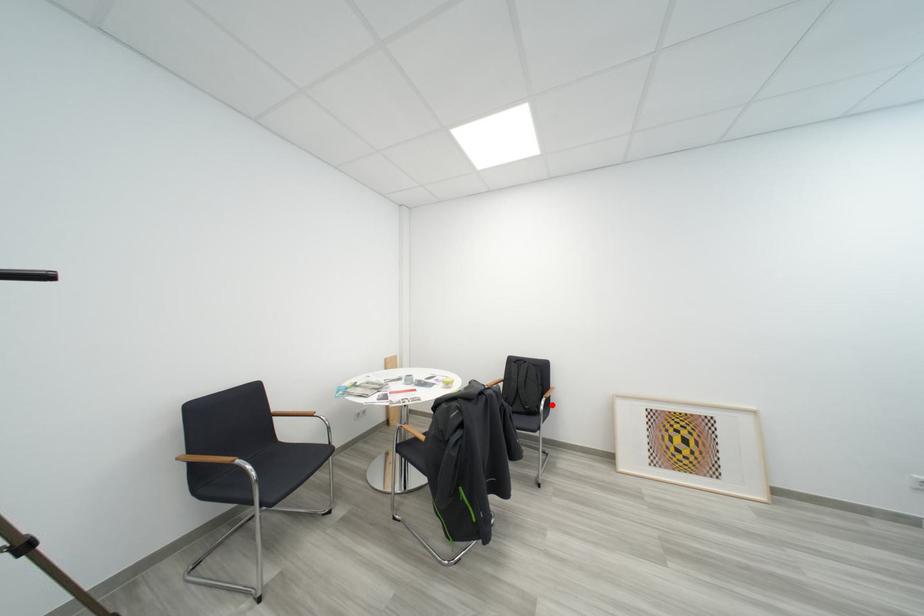
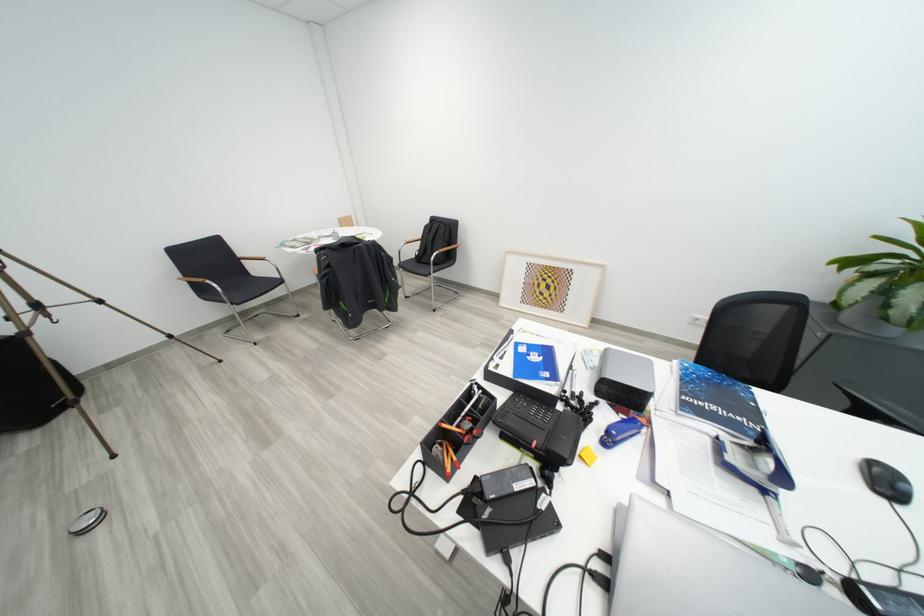
Locate, in the second image, the point that corresponds to the highlighted location in the first image.

(444, 257)